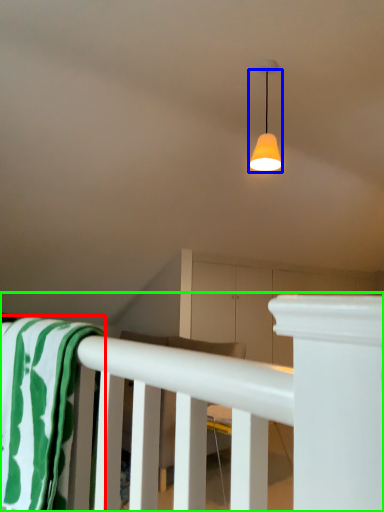
Question: Which is nearer to the beach towel (highlighted by a red box)? lamp (highlighted by a blue box) or rail (highlighted by a green box).

Choices:
 (A) lamp
 (B) rail

Answer: (B)